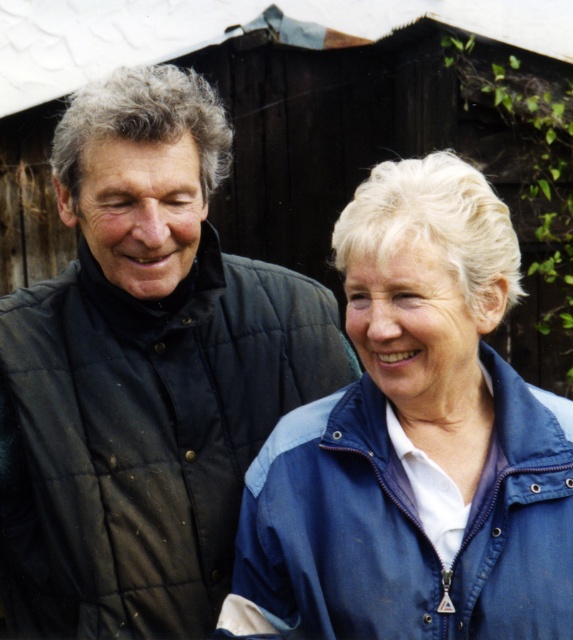
The height and width of the screenshot is (640, 573). What are the coordinates of `matte black jacket at left` in the screenshot? It's located at (143, 372).

Is point (234, 528) positioned behind point (476, 369)?

Yes, it is behind point (476, 369).

Which is behind, point (123, 621) or point (476, 426)?

Point (123, 621)

Identify the location of matte black jacket at left. The width and height of the screenshot is (573, 640). (143, 372).